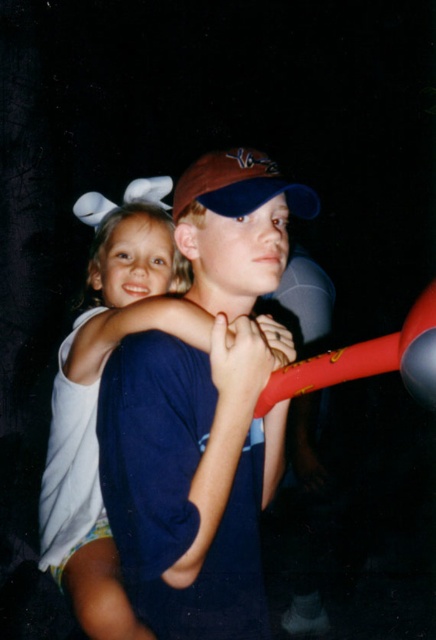
Question: Does white cotton shirt at upper left appear on the right side of brown fabric baseball cap at center?

Choices:
 (A) no
 (B) yes

Answer: (A)

Question: Where is white cotton shirt at upper left located in relation to brown fabric baseball cap at center in the image?

Choices:
 (A) left
 (B) right

Answer: (A)

Question: Does white cotton shirt at upper left appear under brown fabric baseball cap at center?

Choices:
 (A) no
 (B) yes

Answer: (B)

Question: Which point is farther to the camera?

Choices:
 (A) white cotton shirt at upper left
 (B) brown fabric baseball cap at center

Answer: (B)